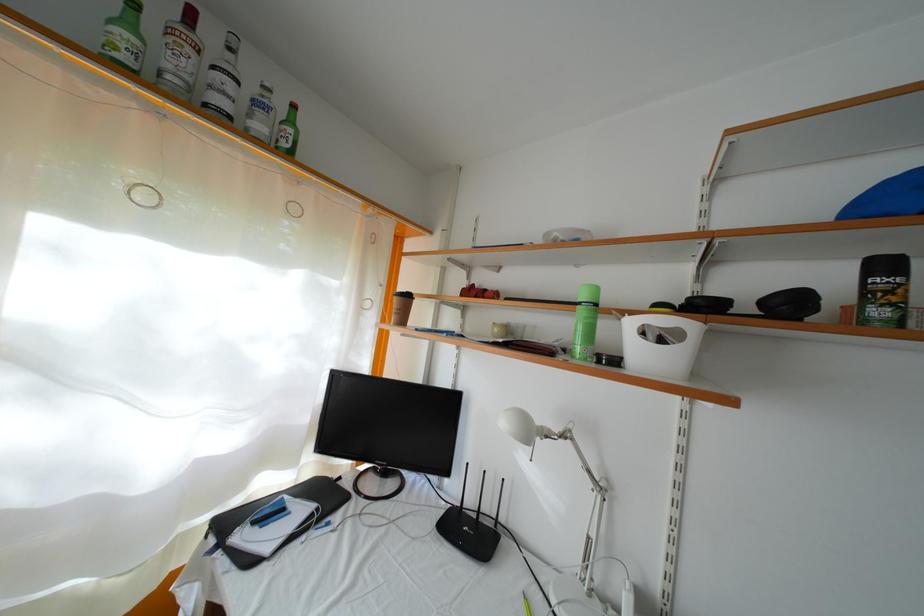
The height and width of the screenshot is (616, 924). In order to click on brown paper cup in this screenshot , I will do `click(400, 307)`.